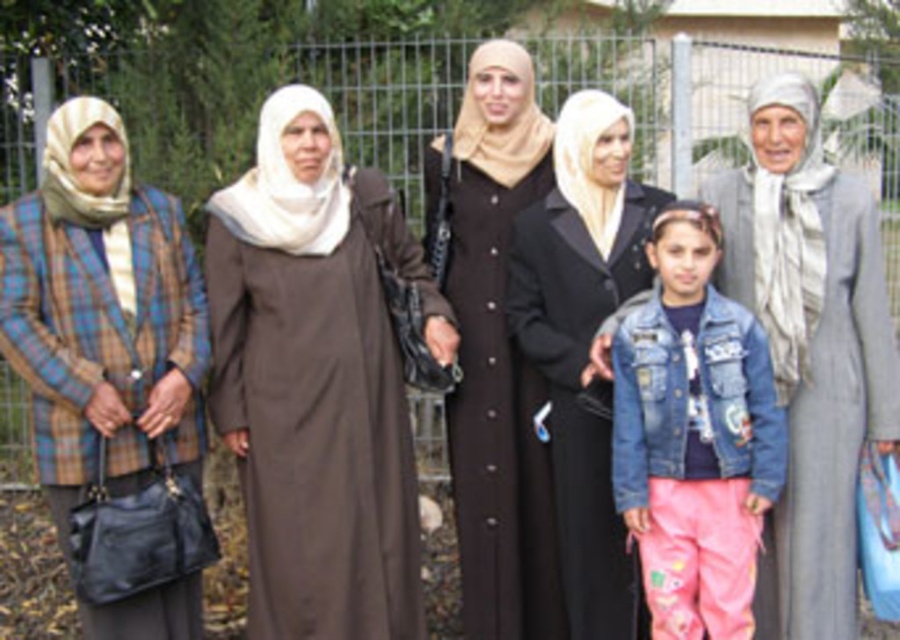
Question: Which of these objects is positioned farthest from the plaid fabric jacket at left?

Choices:
 (A) black satin dress at center
 (B) denim jacket at lower right
 (C) gray woolen dress at right

Answer: (C)

Question: Observing the image, what is the correct spatial positioning of brown matte dress at center in reference to black satin dress at center?

Choices:
 (A) above
 (B) below

Answer: (B)

Question: Which is nearer to the gray woolen dress at right?

Choices:
 (A) black matte dress at center
 (B) denim jacket at lower right
 (C) plaid fabric jacket at left

Answer: (B)

Question: Is brown matte dress at center below plaid fabric jacket at left?

Choices:
 (A) yes
 (B) no

Answer: (B)

Question: Considering the real-world distances, which object is farthest from the denim jacket at lower right?

Choices:
 (A) brown matte dress at center
 (B) black matte dress at center
 (C) black satin dress at center

Answer: (A)

Question: Can you confirm if black matte dress at center is thinner than black satin dress at center?

Choices:
 (A) yes
 (B) no

Answer: (A)